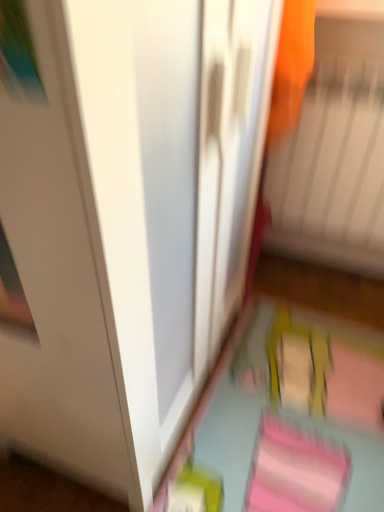
You are a GUI agent. You are given a task and a screenshot of the screen. Output one action in this format:
    pyautogui.click(x=<x>, y=<y>)
    Task: Click on the white plastic radiator at upper right
    This screenshot has height=512, width=384.
    Given the screenshot: What is the action you would take?
    pyautogui.click(x=333, y=170)

This screenshot has width=384, height=512. Describe the element at coordinates (333, 170) in the screenshot. I see `white plastic radiator at upper right` at that location.

The width and height of the screenshot is (384, 512). I want to click on white plastic radiator at upper right, so click(x=333, y=170).